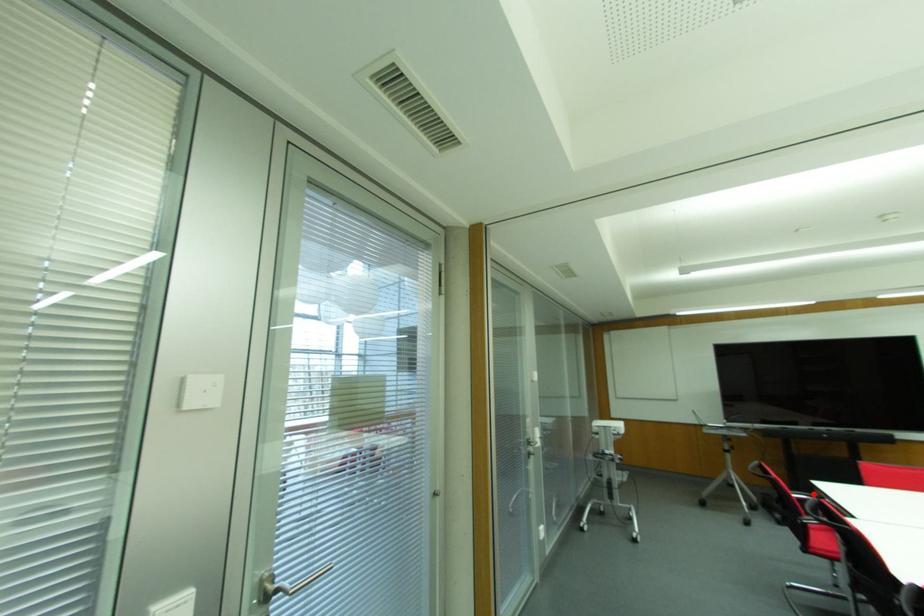
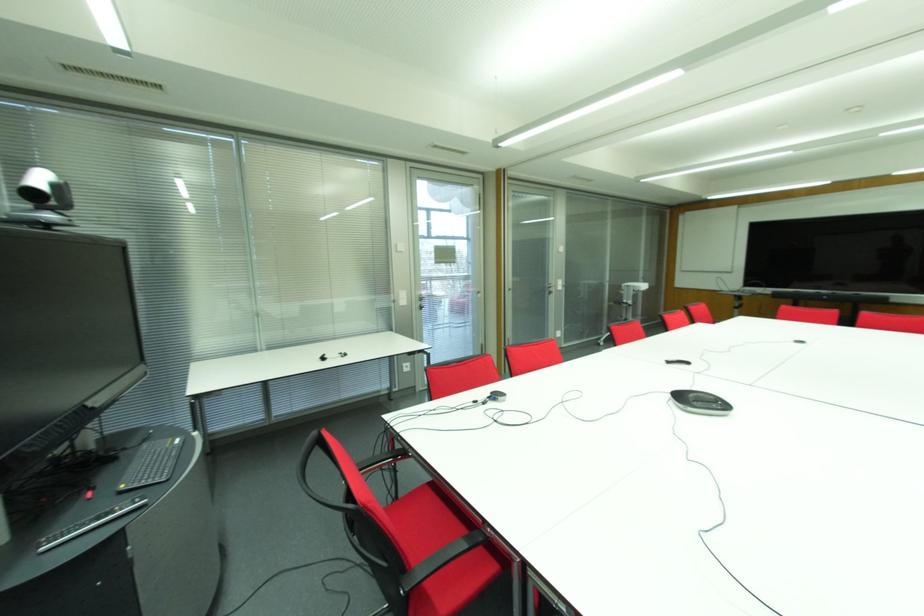
Question: I am providing you with two images of the same scene from different viewpoints. A red point is marked on the first image. At the location where the point appears in image 1, is it still visible in image 2?

Choices:
 (A) Yes
 (B) No

Answer: (B)